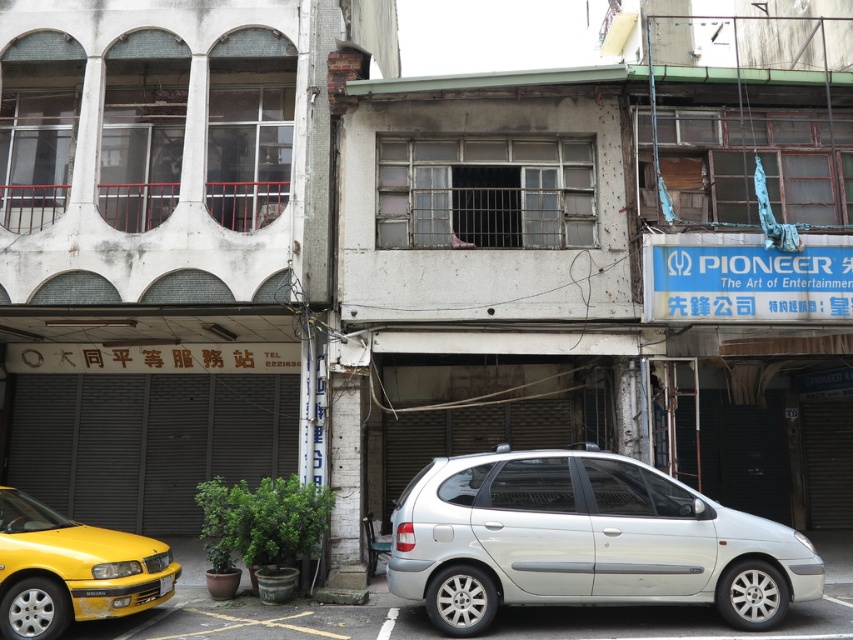
You are a pedestrian standing on the sidewalk looking at the shiny yellow taxi at lower left and the yellow plastic license plate at lower left. Which object is positioned higher from the ground?

The shiny yellow taxi at lower left is above the yellow plastic license plate at lower left, so the shiny yellow taxi at lower left is higher from the ground.

You are a pedestrian standing at the center of the street. You need to walk to the closed storefront with a metal shutter. Which direction should you walk relative to the shiny yellow taxi at lower left?

The shiny yellow taxi at lower left is located at point (70, 570), so you should walk towards the left side of the shiny yellow taxi at lower left to reach the closed storefront with a metal shutter.